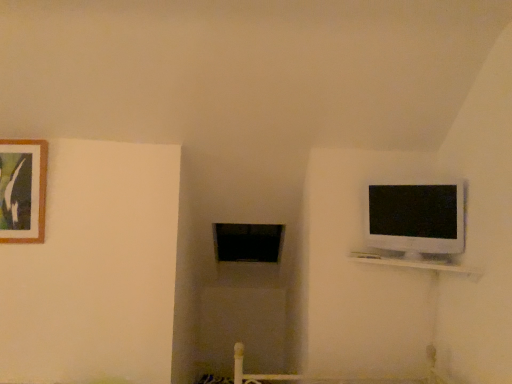
Question: From the image's perspective, would you say wooden picture frame at upper left is shown under white glossy shelf at upper right?

Choices:
 (A) no
 (B) yes

Answer: (A)

Question: Is wooden picture frame at upper left at the right side of white glossy shelf at upper right?

Choices:
 (A) no
 (B) yes

Answer: (A)

Question: Is wooden picture frame at upper left turned away from white glossy shelf at upper right?

Choices:
 (A) no
 (B) yes

Answer: (A)

Question: Does wooden picture frame at upper left have a lesser height compared to white glossy shelf at upper right?

Choices:
 (A) no
 (B) yes

Answer: (A)

Question: Can you confirm if wooden picture frame at upper left is taller than white glossy shelf at upper right?

Choices:
 (A) yes
 (B) no

Answer: (A)

Question: From a real-world perspective, is wooden picture frame at upper left positioned over white glossy shelf at upper right based on gravity?

Choices:
 (A) yes
 (B) no

Answer: (A)

Question: From a real-world perspective, does wooden picture frame at upper left stand above white glossy television at upper right?

Choices:
 (A) yes
 (B) no

Answer: (A)

Question: Does wooden picture frame at upper left turn towards white glossy television at upper right?

Choices:
 (A) yes
 (B) no

Answer: (B)

Question: Is wooden picture frame at upper left shorter than white glossy television at upper right?

Choices:
 (A) yes
 (B) no

Answer: (B)

Question: Does wooden picture frame at upper left have a greater width compared to white glossy television at upper right?

Choices:
 (A) no
 (B) yes

Answer: (A)

Question: From the image's perspective, is wooden picture frame at upper left on white glossy television at upper right?

Choices:
 (A) yes
 (B) no

Answer: (A)

Question: Can you confirm if wooden picture frame at upper left is thinner than white glossy television at upper right?

Choices:
 (A) no
 (B) yes

Answer: (B)

Question: Does white glossy shelf at upper right have a lesser height compared to white glossy television at upper right?

Choices:
 (A) no
 (B) yes

Answer: (B)